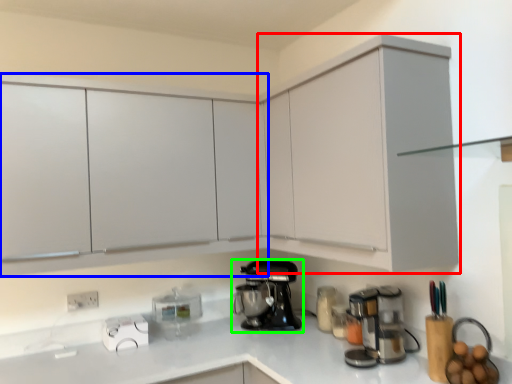
Question: Considering the real-world distances, which object is closest to cabinetry (highlighted by a red box)? cabinetry (highlighted by a blue box) or kitchen appliance (highlighted by a green box).

Choices:
 (A) cabinetry
 (B) kitchen appliance

Answer: (B)